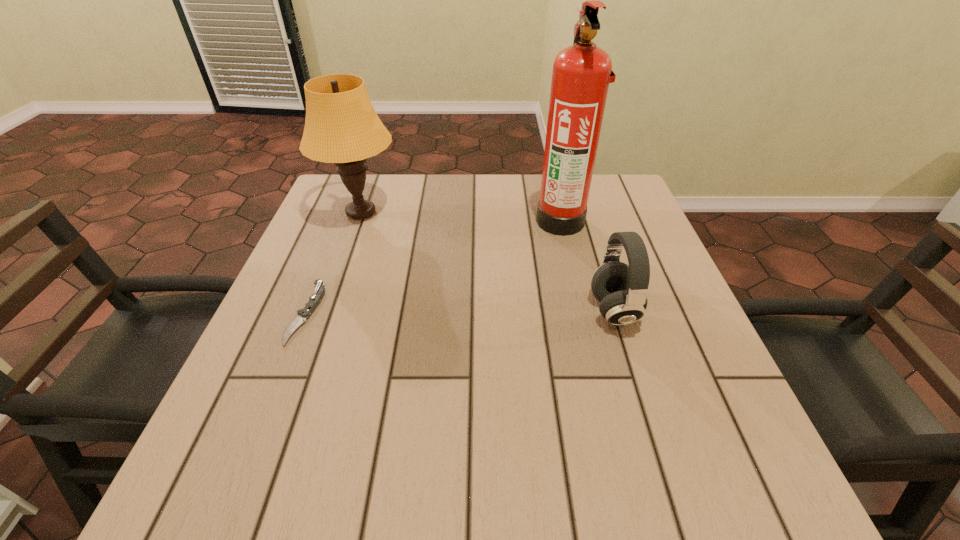
Find the location of `vacant position in the image that satisfies the following two spatial constraints: 1. with the nozzle pointing from the back of the tallest object; 2. on the front side of the shortest object`. vacant position in the image that satisfies the following two spatial constraints: 1. with the nozzle pointing from the back of the tallest object; 2. on the front side of the shortest object is located at coordinates (583, 313).